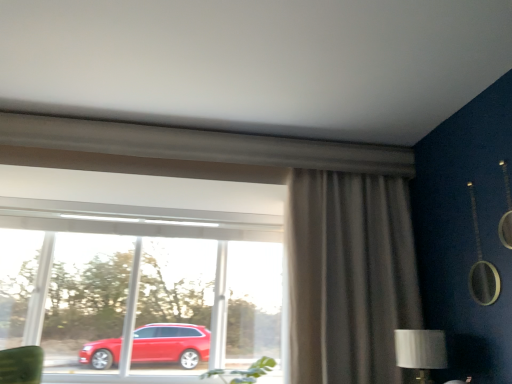
Question: Is matte gray curtain at right positioned with its back to transparent glass window at center?

Choices:
 (A) yes
 (B) no

Answer: (B)

Question: From a real-world perspective, is matte gray curtain at right located higher than transparent glass window at center?

Choices:
 (A) no
 (B) yes

Answer: (B)

Question: Can transparent glass window at center be found inside matte gray curtain at right?

Choices:
 (A) yes
 (B) no

Answer: (B)

Question: Considering the relative sizes of matte gray curtain at right and transparent glass window at center in the image provided, is matte gray curtain at right thinner than transparent glass window at center?

Choices:
 (A) yes
 (B) no

Answer: (B)

Question: Considering the relative positions of matte gray curtain at right and transparent glass window at center in the image provided, is matte gray curtain at right to the left of transparent glass window at center from the viewer's perspective?

Choices:
 (A) no
 (B) yes

Answer: (A)

Question: Is transparent glass window at center taller or shorter than matte gray curtain at right?

Choices:
 (A) tall
 (B) short

Answer: (B)

Question: From the image's perspective, relative to matte gray curtain at right, is transparent glass window at center above or below?

Choices:
 (A) below
 (B) above

Answer: (A)

Question: Considering their positions, is transparent glass window at center located in front of or behind matte gray curtain at right?

Choices:
 (A) front
 (B) behind

Answer: (B)

Question: Based on their sizes in the image, would you say transparent glass window at center is bigger or smaller than matte gray curtain at right?

Choices:
 (A) big
 (B) small

Answer: (A)

Question: Is matte gray curtain at right in front of or behind silver metallic table lamp at lower right in the image?

Choices:
 (A) behind
 (B) front

Answer: (A)

Question: Does point (395, 258) appear closer or farther from the camera than point (397, 365)?

Choices:
 (A) farther
 (B) closer

Answer: (A)

Question: Considering the positions of matte gray curtain at right and silver metallic table lamp at lower right in the image, is matte gray curtain at right wider or thinner than silver metallic table lamp at lower right?

Choices:
 (A) thin
 (B) wide

Answer: (B)

Question: Based on their sizes in the image, would you say matte gray curtain at right is bigger or smaller than silver metallic table lamp at lower right?

Choices:
 (A) big
 (B) small

Answer: (A)

Question: Is point (419, 345) positioned closer to the camera than point (387, 256)?

Choices:
 (A) farther
 (B) closer

Answer: (B)

Question: In terms of width, does silver metallic table lamp at lower right look wider or thinner when compared to matte gray curtain at right?

Choices:
 (A) wide
 (B) thin

Answer: (B)